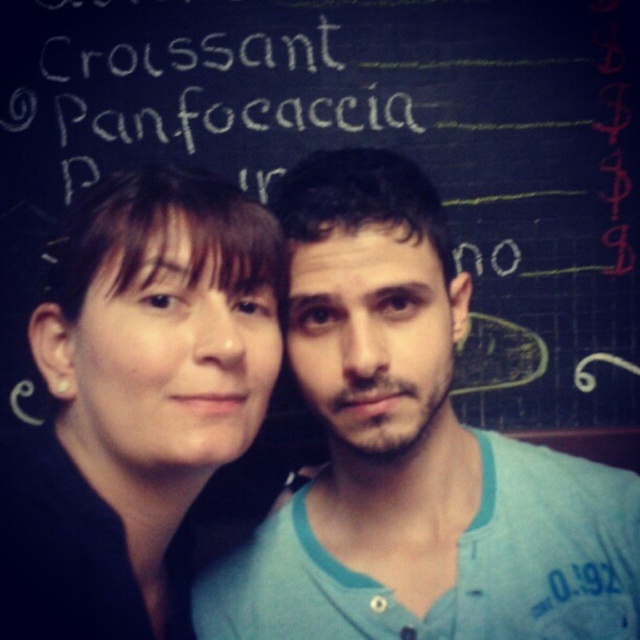
Is black chalkboard at upper center to the right of white chalk writing at upper center from the viewer's perspective?

Correct, you'll find black chalkboard at upper center to the right of white chalk writing at upper center.

Describe the element at coordinates (368, 144) in the screenshot. I see `black chalkboard at upper center` at that location.

Which is behind, point (563, 337) or point (76, 65)?

Positioned behind is point (563, 337).

Where is `black chalkboard at upper center`? The width and height of the screenshot is (640, 640). black chalkboard at upper center is located at coordinates (368, 144).

Can you confirm if blue cotton shirt at center is taller than matte black hair at upper left?

Indeed, blue cotton shirt at center has a greater height compared to matte black hair at upper left.

Who is positioned more to the left, blue cotton shirt at center or matte black hair at upper left?

From the viewer's perspective, matte black hair at upper left appears more on the left side.

Does point (381, 221) come behind point (136, 493)?

No, it is not.

The height and width of the screenshot is (640, 640). Identify the location of blue cotton shirt at center. (412, 452).

Describe the element at coordinates (368, 144) in the screenshot. I see `black chalkboard at upper center` at that location.

Does black chalkboard at upper center have a greater height compared to matte black hair at upper left?

Indeed, black chalkboard at upper center has a greater height compared to matte black hair at upper left.

This screenshot has width=640, height=640. I want to click on black chalkboard at upper center, so click(x=368, y=144).

Locate an element on the screen. This screenshot has height=640, width=640. black chalkboard at upper center is located at coordinates (368, 144).